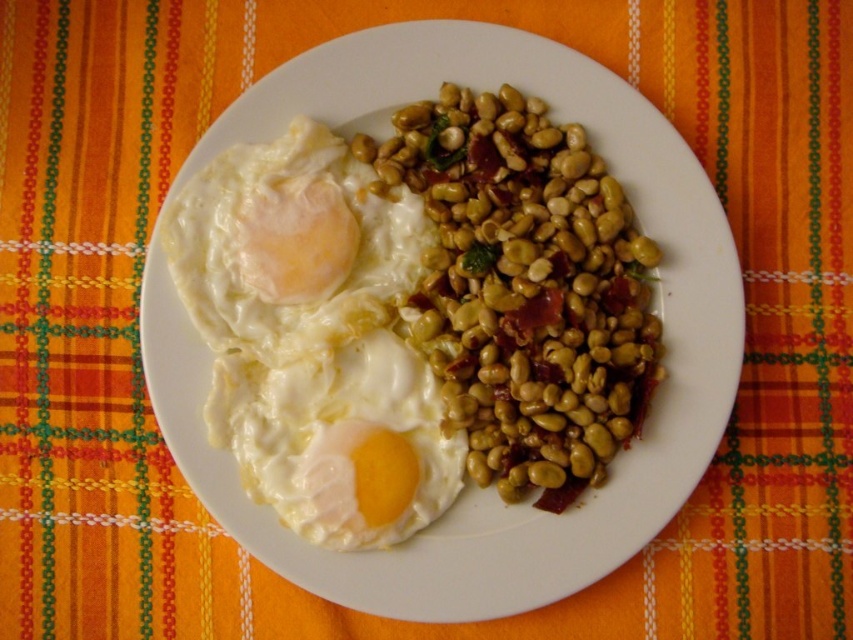
You are a chef preparing a dish and need to know the spatial arrangement of the items on the plate. Which object is wider, the green matte beans at center or the white matte fried egg at upper left?

The green matte beans at center is wider than the white matte fried egg at upper left according to the description.

You are a chef preparing a dish and need to know the size of the eggs on the plate. Which egg, the white matte fried egg at upper left or the white creamy egg at center, is wider?

The white matte fried egg at upper left is wider than the white creamy egg at center.

You are a food critic evaluating this dish. You need to describe the spatial arrangement of the green matte beans at center and the white creamy egg at center. Which one is closer to you?

The green matte beans at center are closer to the viewer than the white creamy egg at center.